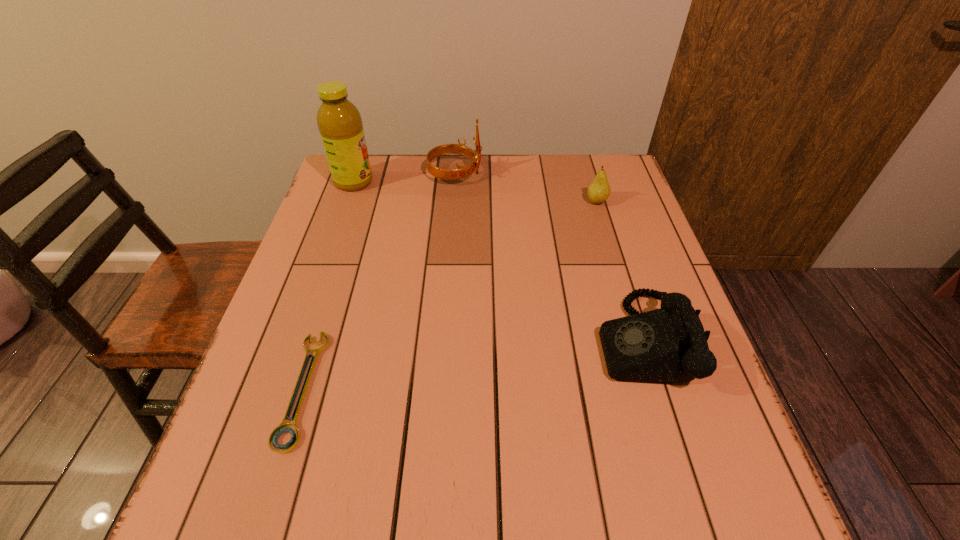
Locate an element on the screen. fruit juice is located at coordinates (339, 122).

What are the coordinates of `the third object from left to right` in the screenshot? It's located at (447, 174).

Find the location of a particular element. tiara is located at coordinates (447, 174).

At what (x,y) coordinates should I click in order to perform the action: click on pear. Please return your answer as a coordinate pair (x, y). The width and height of the screenshot is (960, 540). Looking at the image, I should click on (599, 190).

This screenshot has height=540, width=960. What are the coordinates of `telephone` in the screenshot? It's located at (668, 345).

The height and width of the screenshot is (540, 960). What are the coordinates of `wrench` in the screenshot? It's located at (284, 427).

Identify the location of free region located 0.220m on the front label of the tallest object. Image resolution: width=960 pixels, height=540 pixels. (446, 182).

Locate an element on the screen. vacant region located 0.360m on the front-facing side of the tiara is located at coordinates (599, 174).

Where is `free point located on the front of the pear`? This screenshot has height=540, width=960. free point located on the front of the pear is located at coordinates (608, 237).

Locate an element on the screen. This screenshot has height=540, width=960. vacant position located 0.390m on the dial of the telephone is located at coordinates (412, 341).